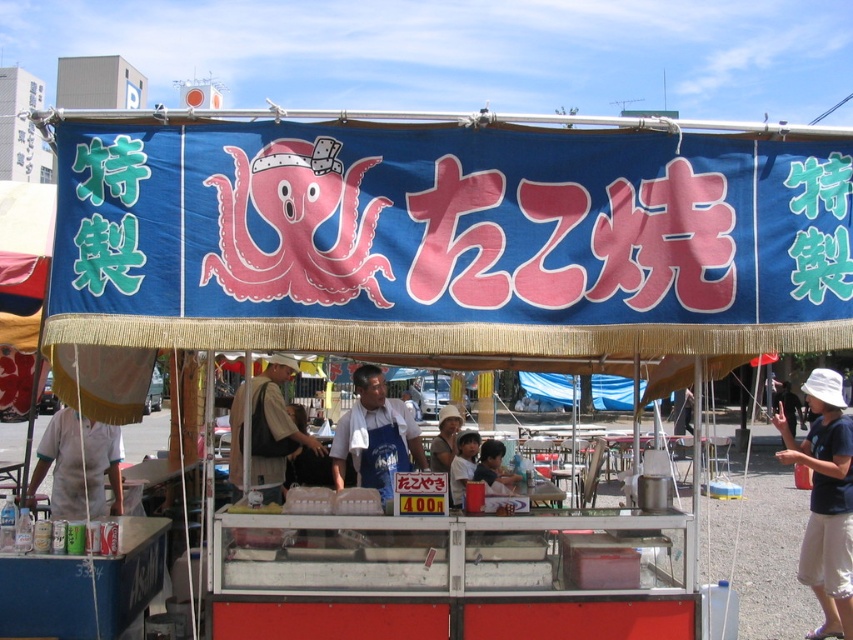
You are standing in front of the street food stall and want to locate the blue fabric canopy at upper center. According to the coordinates provided, where exactly is it positioned?

The blue fabric canopy at upper center is located at point coordinates of (450,236).

In the scene shown: You are a food stall worker wearing the blue apron at center. You need to reach the blue fabric canopy at upper center to adjust its position. Can you do this without moving from your current position?

The blue fabric canopy at upper center and blue apron at center are 3.00 meters apart, so you can reach the canopy if you can stretch your arms that far. However, typically, a 3.00 meter distance is beyond normal human arm reach. Therefore, you would need to move closer to adjust the canopy.